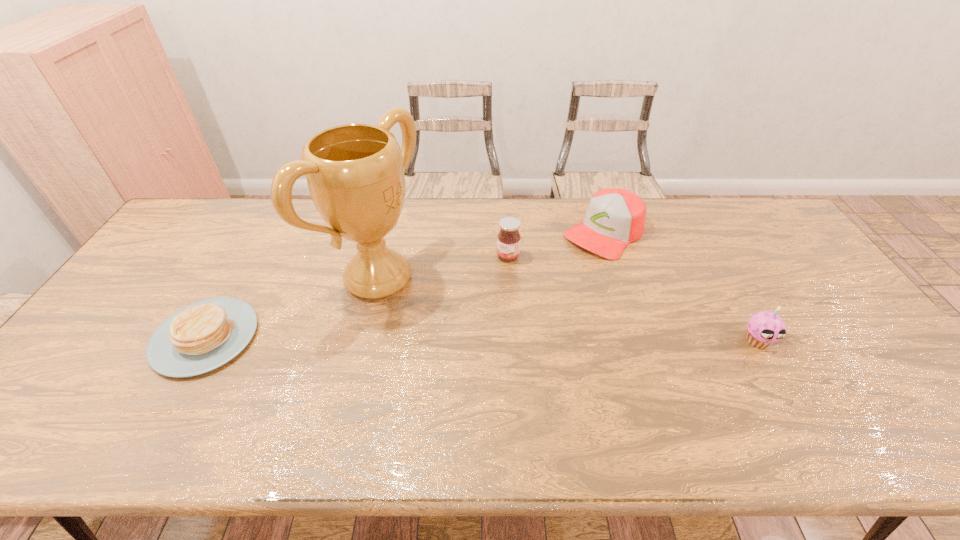
This screenshot has height=540, width=960. I want to click on vacant space that satisfies the following two spatial constraints: 1. on the back side of the baseball cap; 2. on the right side of the shortest object, so click(x=265, y=232).